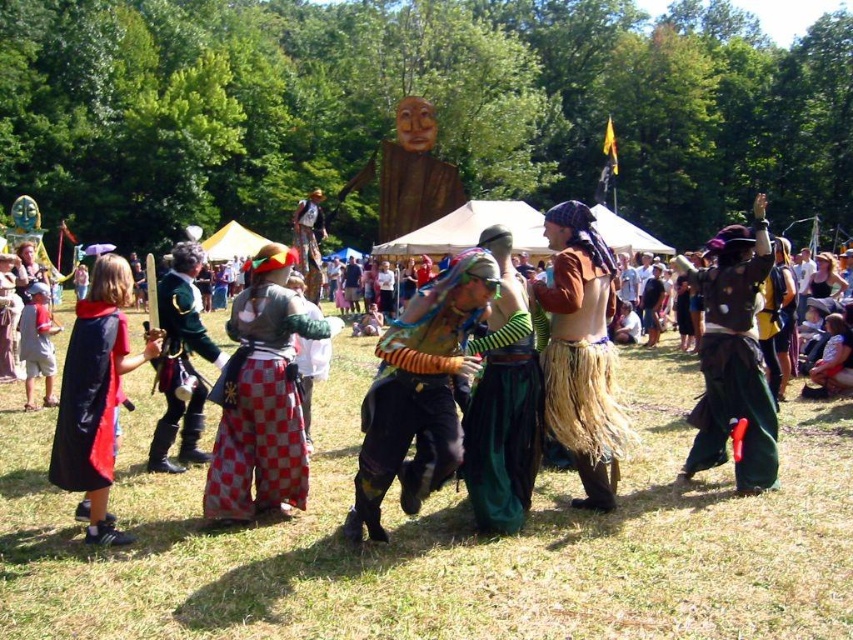
Question: Does orange striped tunic at center have a larger size compared to green woven skirt at center?

Choices:
 (A) no
 (B) yes

Answer: (B)

Question: Is red checkered pants at center positioned before green velvet jacket at center?

Choices:
 (A) no
 (B) yes

Answer: (B)

Question: Which of the following is the closest to the observer?

Choices:
 (A) (424, 460)
 (B) (117, 355)
 (C) (622, 420)
 (D) (753, 416)

Answer: (A)

Question: Based on their relative distances, which object is nearer to the orange striped tunic at center?

Choices:
 (A) brown leather vest at center
 (B) red checkered pants at center
 (C) green velvet jacket at center

Answer: (B)

Question: Can you confirm if orange striped tunic at center is positioned below green woven skirt at right?

Choices:
 (A) no
 (B) yes

Answer: (B)

Question: Which point appears farthest from the camera in this image?

Choices:
 (A) (268, 346)
 (B) (482, 456)

Answer: (A)